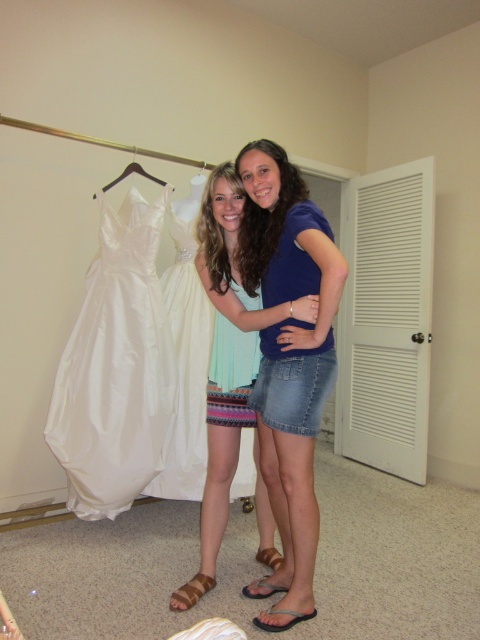
Question: Where is white satin dress at left located in relation to denim skirt at center in the image?

Choices:
 (A) left
 (B) right

Answer: (A)

Question: Which point appears closest to the camera in this image?

Choices:
 (A) (279, 609)
 (B) (144, 172)
 (C) (206, 163)
 (D) (256, 243)

Answer: (A)

Question: Is light blue woven fabric dress at center to the right of black plastic hanger at upper left from the viewer's perspective?

Choices:
 (A) yes
 (B) no

Answer: (A)

Question: Which object is the farthest from the black plastic hanger at upper left?

Choices:
 (A) white satin dress at left
 (B) brown suede sandal at lower center
 (C) light blue woven fabric dress at center

Answer: (B)

Question: Is the position of denim skirt at center more distant than that of black plastic hanger at upper left?

Choices:
 (A) yes
 (B) no

Answer: (B)

Question: Which point is farther to the camera?

Choices:
 (A) denim skirt at center
 (B) black fabric sandal at lower center

Answer: (B)